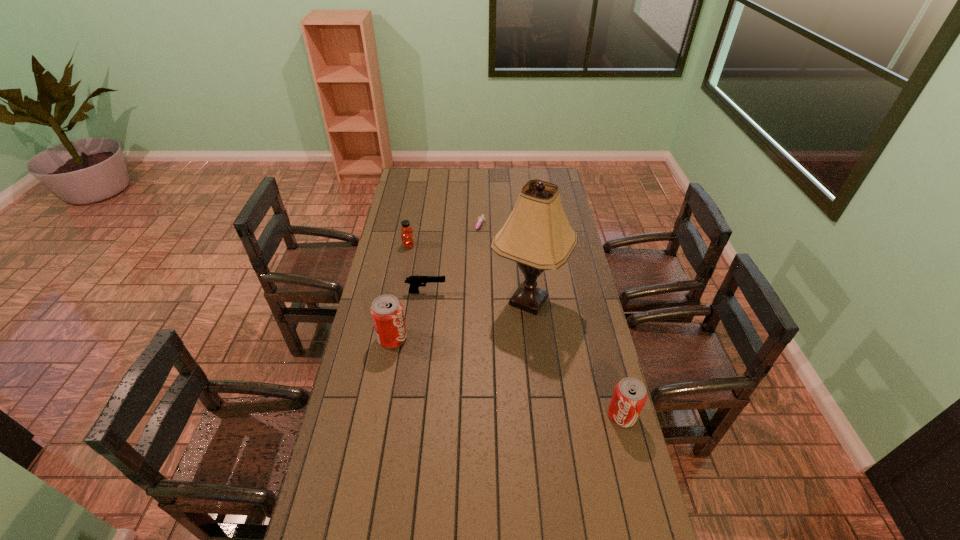
Please point a spot to place another pop_(soda) for symmetrical spacing. Please provide its 2D coordinates. Your answer should be formatted as a tuple, i.e. [(x, y)], where the tuple contains the x and y coordinates of a point satisfying the conditions above.

[(498, 374)]